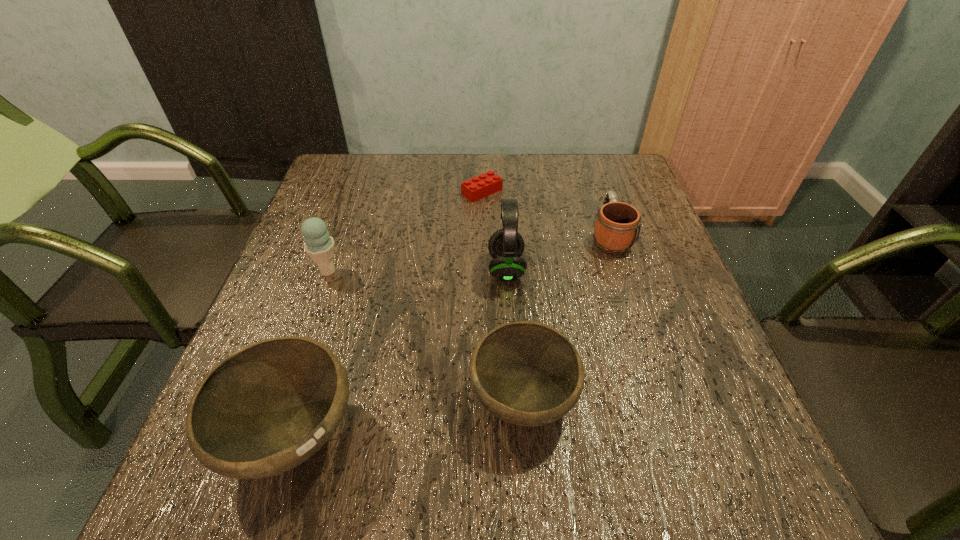
Identify the location of object that is the closest to the taller bowl. The height and width of the screenshot is (540, 960). (526, 373).

Locate an element on the screen. The height and width of the screenshot is (540, 960). free region that satisfies the following two spatial constraints: 1. on the front side of the farthest object; 2. on the right side of the shorter bowl is located at coordinates (483, 400).

At what (x,y) coordinates should I click in order to perform the action: click on free space in the image that satisfies the following two spatial constraints: 1. on the front side of the shorter bowl; 2. on the right side of the Lego. Please return your answer as a coordinate pair (x, y). The height and width of the screenshot is (540, 960). Looking at the image, I should click on (483, 400).

Identify the location of vacant region that satisfies the following two spatial constraints: 1. on the ear cups of the tallest object; 2. on the front side of the left bowl. This screenshot has height=540, width=960. (516, 436).

What are the coordinates of `free location that satisfies the following two spatial constraints: 1. on the ear cups of the tallest object; 2. on the left side of the right bowl` in the screenshot? It's located at (515, 400).

Locate an element on the screen. This screenshot has width=960, height=540. vacant space that satisfies the following two spatial constraints: 1. on the back side of the right bowl; 2. on the ear cups of the tallest object is located at coordinates (513, 268).

The width and height of the screenshot is (960, 540). I want to click on vacant space that satisfies the following two spatial constraints: 1. on the ear cups of the headset; 2. on the front side of the ice cream, so click(x=506, y=271).

Locate an element on the screen. This screenshot has width=960, height=540. vacant position in the image that satisfies the following two spatial constraints: 1. on the ear cups of the tallest object; 2. on the front side of the left bowl is located at coordinates (516, 436).